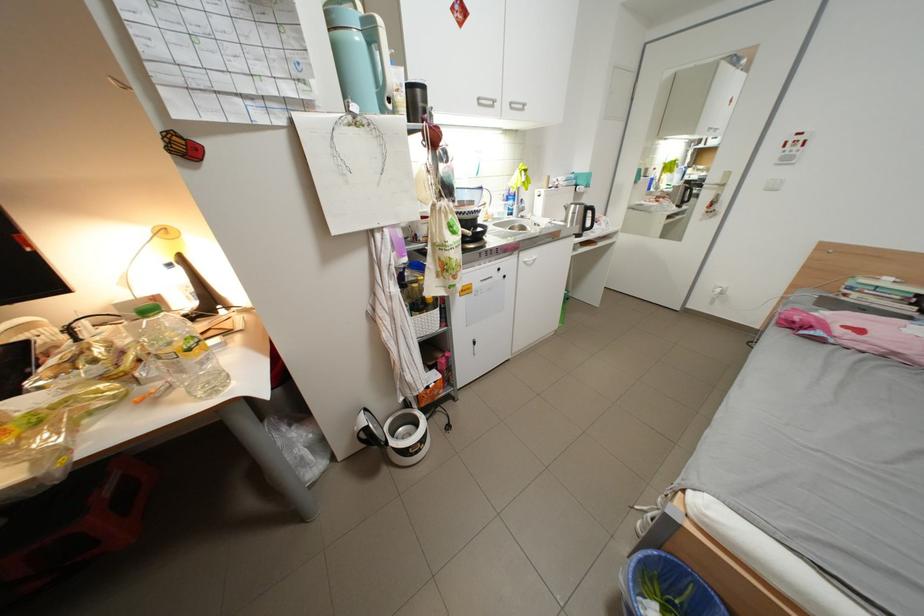
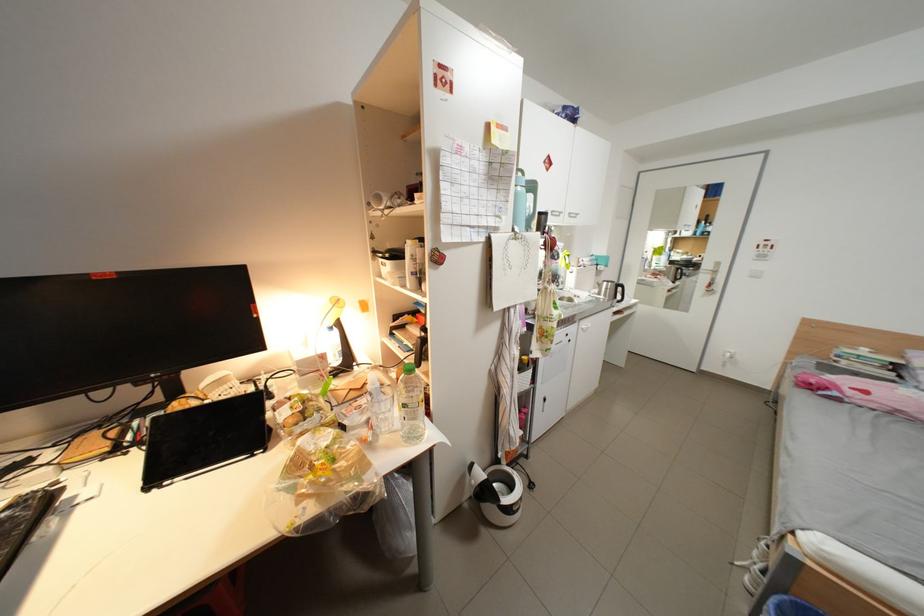
Find the pixel in the second image that matches [168,301] in the first image.

(334, 358)